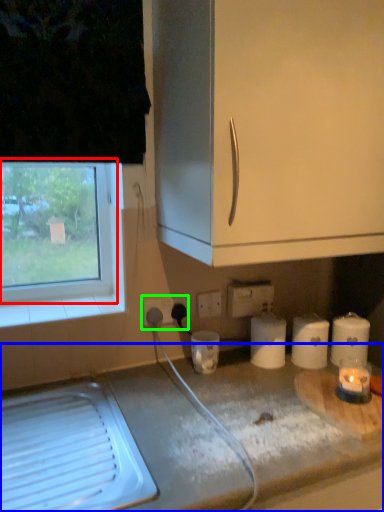
Question: Considering the real-world distances, which object is closest to window (highlighted by a red box)? countertop (highlighted by a blue box) or electric outlet (highlighted by a green box).

Choices:
 (A) countertop
 (B) electric outlet

Answer: (B)